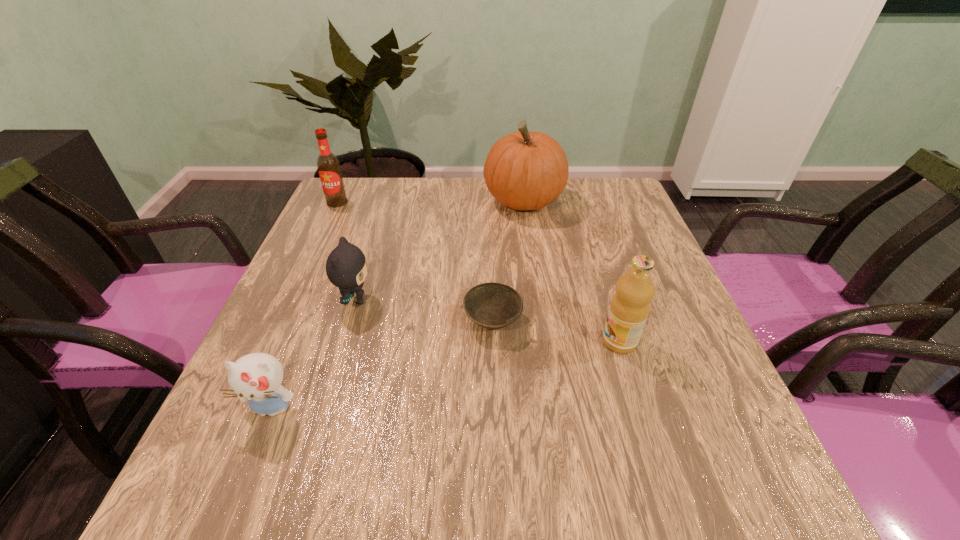
Identify the location of pumpkin. (524, 170).

Where is `beer bottle`? beer bottle is located at coordinates (328, 165).

What are the coordinates of `olive oil` in the screenshot? It's located at (629, 308).

I want to click on the right kitten, so click(x=346, y=267).

Where is `the farther kitten`? This screenshot has width=960, height=540. the farther kitten is located at coordinates pos(346,267).

Where is `the nearer kitten`? the nearer kitten is located at coordinates (257, 377).

This screenshot has width=960, height=540. Find the location of `the left kitten`. the left kitten is located at coordinates (257, 377).

Find the location of `bowl`. bowl is located at coordinates (491, 305).

I want to click on vacant space situated 0.060m on the stem of the pumpkin, so coord(463,201).

The height and width of the screenshot is (540, 960). In order to click on free space located 0.050m on the stem of the pumpkin in this screenshot , I will do `click(466, 201)`.